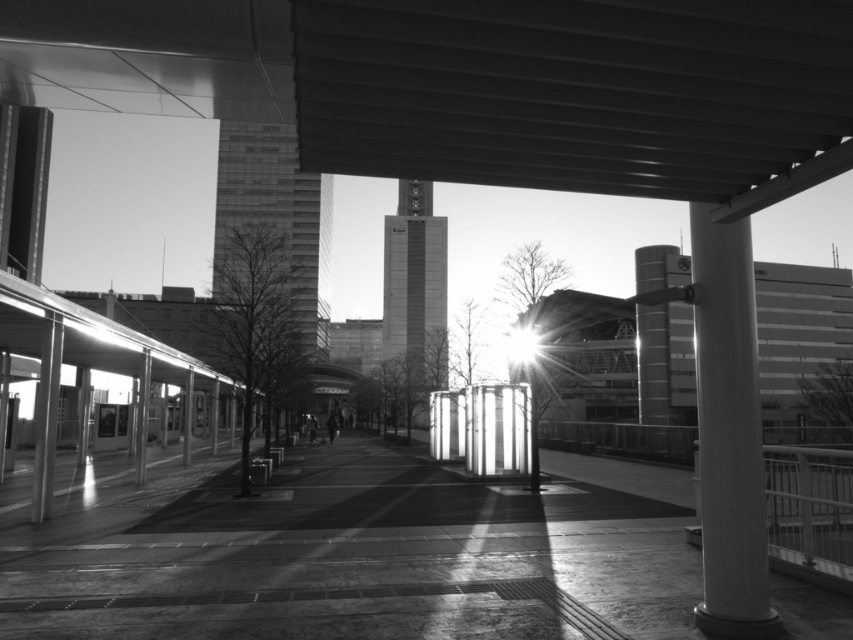
Does smooth concrete pavement at center have a larger size compared to smooth white column at right?

Yes, smooth concrete pavement at center is bigger than smooth white column at right.

Can you confirm if smooth concrete pavement at center is shorter than smooth white column at right?

Correct, smooth concrete pavement at center is not as tall as smooth white column at right.

Which is in front, point (238, 595) or point (753, 593)?

Positioned in front is point (753, 593).

Locate an element on the screen. smooth concrete pavement at center is located at coordinates point(357,561).

Can you confirm if metallic roof at upper center is positioned to the left of smooth concrete pavement at center?

In fact, metallic roof at upper center is to the right of smooth concrete pavement at center.

Who is positioned more to the right, metallic roof at upper center or smooth concrete pavement at center?

metallic roof at upper center

Which is in front, point (583, 115) or point (213, 573)?

Point (583, 115) is more forward.

This screenshot has width=853, height=640. I want to click on metallic roof at upper center, so click(x=506, y=84).

Which is more to the left, metallic roof at upper center or smooth gray pillar at right?

metallic roof at upper center

Which is above, metallic roof at upper center or smooth gray pillar at right?

Positioned higher is metallic roof at upper center.

This screenshot has height=640, width=853. I want to click on metallic roof at upper center, so click(x=506, y=84).